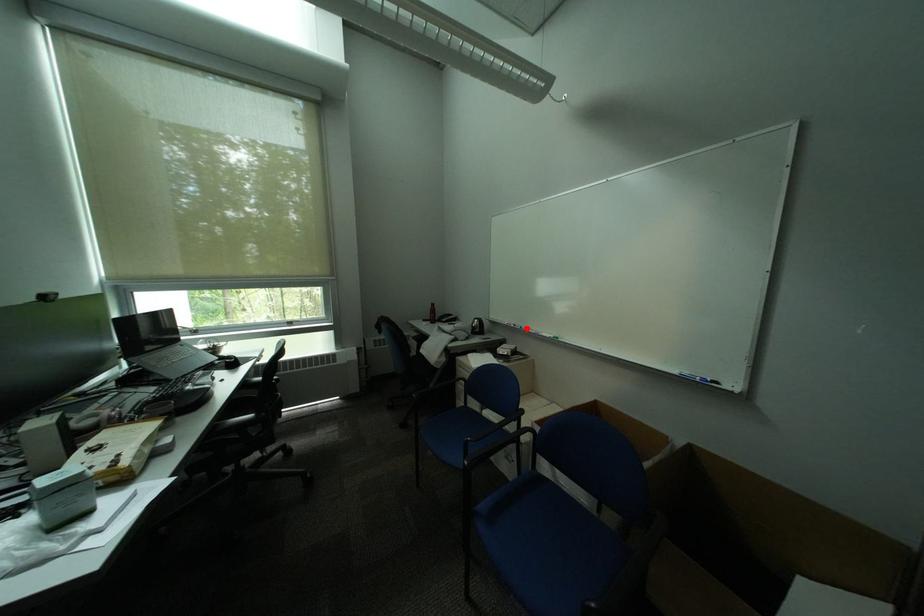
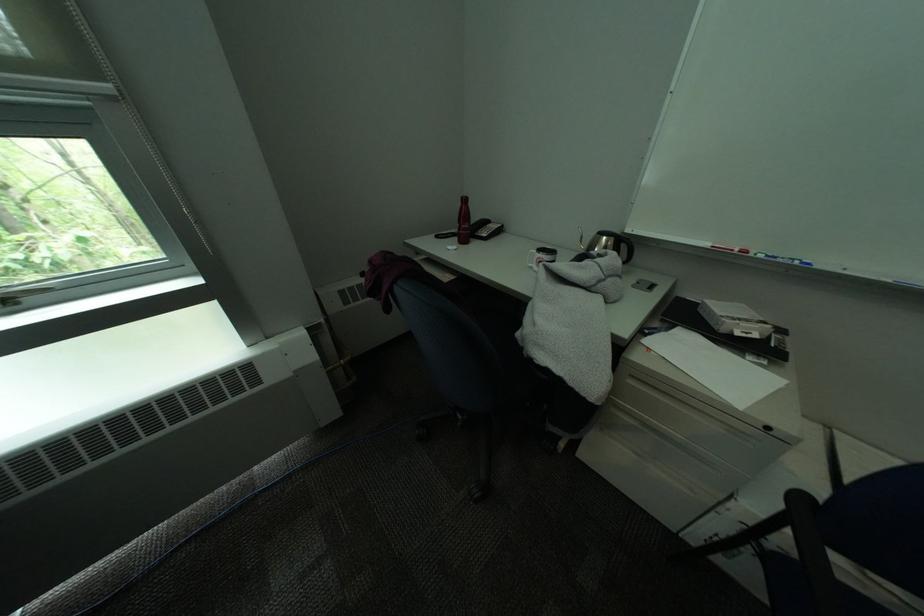
In the second image, find the point that corresponds to the highlighted location in the first image.

(791, 262)